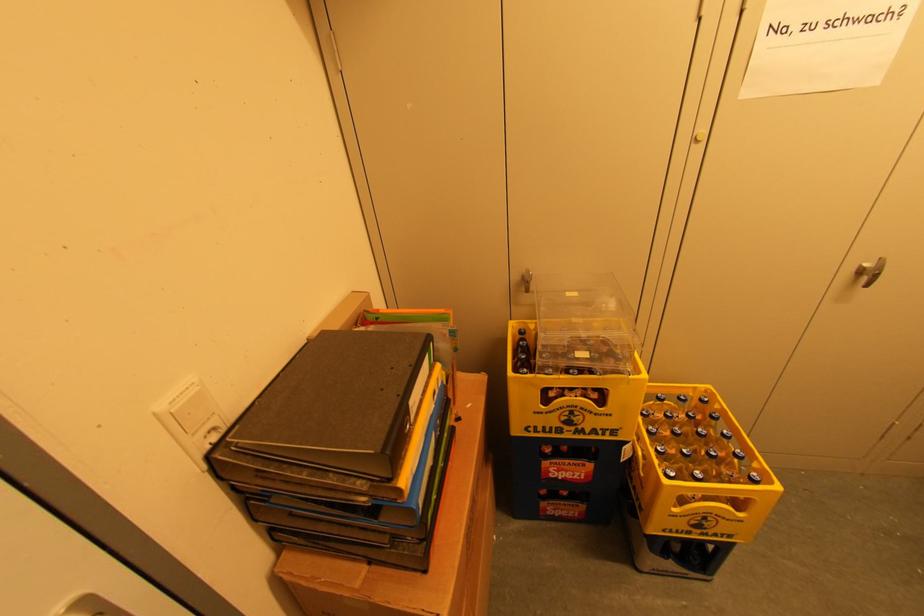
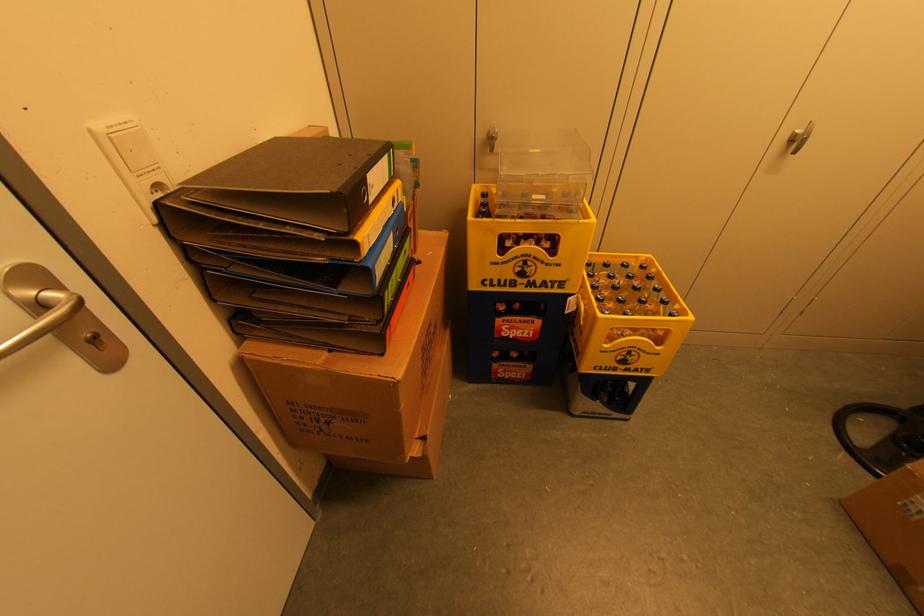
The point at (578, 419) is marked in the first image. Where is the corresponding point in the second image?

(530, 270)